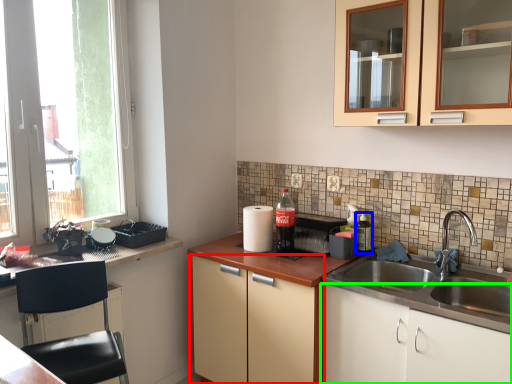
Question: Considering the real-world distances, which object is closest to cabinetry (highlighted by a red box)? bottle (highlighted by a blue box) or cabinetry (highlighted by a green box).

Choices:
 (A) bottle
 (B) cabinetry

Answer: (B)